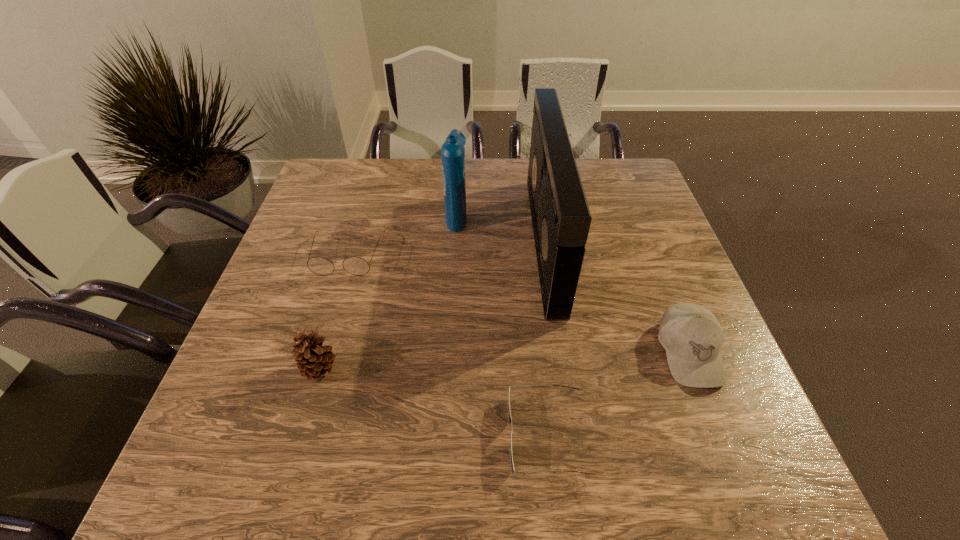
Find the location of a particular element. object at the near edge is located at coordinates 509,414.

The width and height of the screenshot is (960, 540). I want to click on pinecone that is at the left edge, so click(x=314, y=360).

Find the location of a particular element. The height and width of the screenshot is (540, 960). spectacles at the left edge is located at coordinates (357, 266).

Where is `object that is at the right edge`? This screenshot has height=540, width=960. object that is at the right edge is located at coordinates tap(691, 335).

In the image, there is a desktop. In order to click on free space at the far edge in this screenshot , I will do `click(482, 200)`.

The height and width of the screenshot is (540, 960). What are the coordinates of `vacant area at the near edge` in the screenshot? It's located at (375, 455).

This screenshot has width=960, height=540. Identify the location of free location at the left edge. (286, 247).

Find the location of a particular element. free space at the right edge is located at coordinates (650, 373).

The width and height of the screenshot is (960, 540). I want to click on vacant space at the far right corner of the desktop, so click(626, 158).

Find the location of `vacant area that lies between the shampoo and the spectacles`. vacant area that lies between the shampoo and the spectacles is located at coordinates (402, 236).